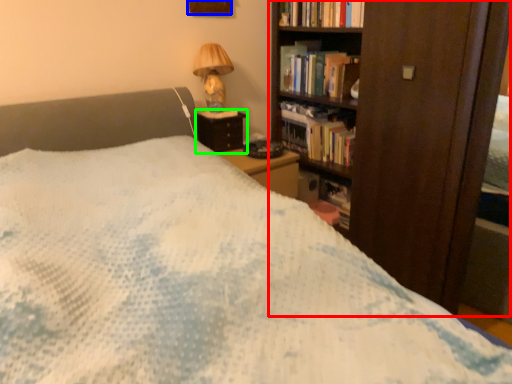
Question: Based on their relative distances, which object is farther from bookcase (highlighted by a red box)? Choose from picture frame (highlighted by a blue box) and nightstand (highlighted by a green box).

Choices:
 (A) picture frame
 (B) nightstand

Answer: (A)